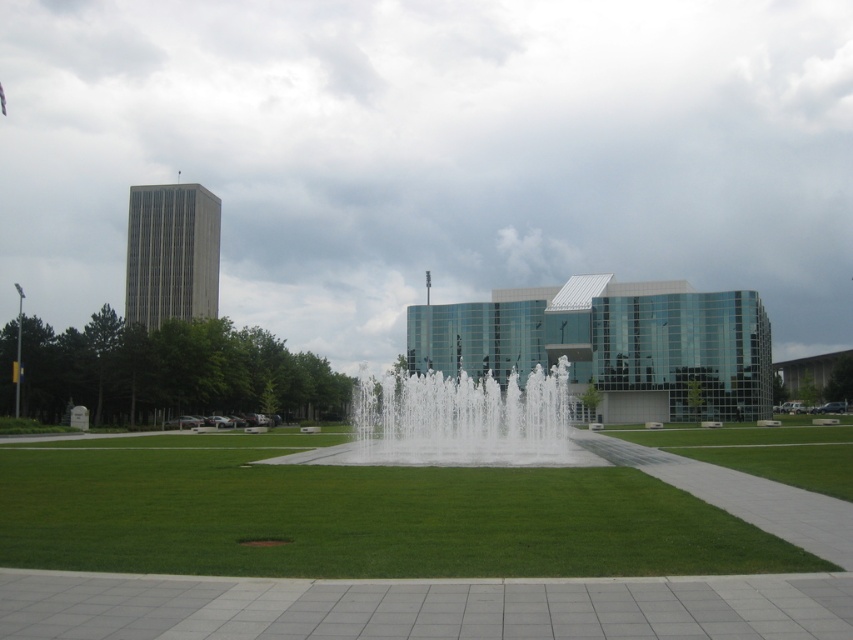
Does green grass at center lie in front of white water at center?

Yes, it is in front of white water at center.

Can you confirm if green grass at center is positioned to the left of white water at center?

Indeed, green grass at center is positioned on the left side of white water at center.

Identify the location of green grass at center. The image size is (853, 640). (354, 515).